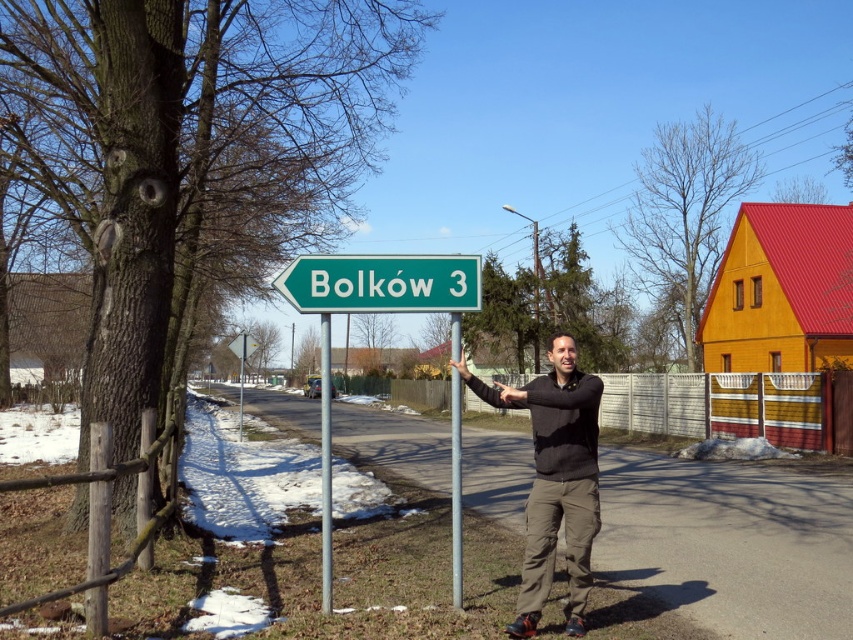
Can you confirm if black matte sweater at center is bigger than green metallic pole at center?

Incorrect, black matte sweater at center is not larger than green metallic pole at center.

Can you confirm if black matte sweater at center is shorter than green metallic pole at center?

Correct, black matte sweater at center is not as tall as green metallic pole at center.

Who is more distant from viewer, (544, 444) or (457, 570)?

Positioned behind is point (457, 570).

The height and width of the screenshot is (640, 853). Identify the location of black matte sweater at center. (555, 480).

Is metallic pole at center bigger than green metallic pole at center?

Correct, metallic pole at center is larger in size than green metallic pole at center.

Who is more distant from viewer, [328,340] or [453,429]?

Point [453,429]

Identify the location of metallic pole at center. The image size is (853, 640). (325, 465).

Can you confirm if black matte sweater at center is smaller than metallic pole at center?

Correct, black matte sweater at center occupies less space than metallic pole at center.

Locate an element on the screen. black matte sweater at center is located at coordinates (555, 480).